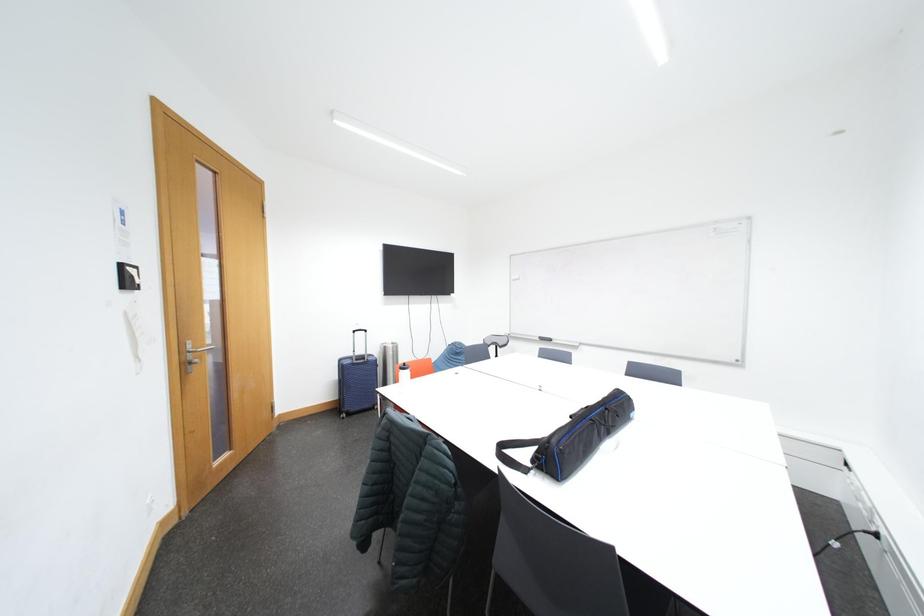
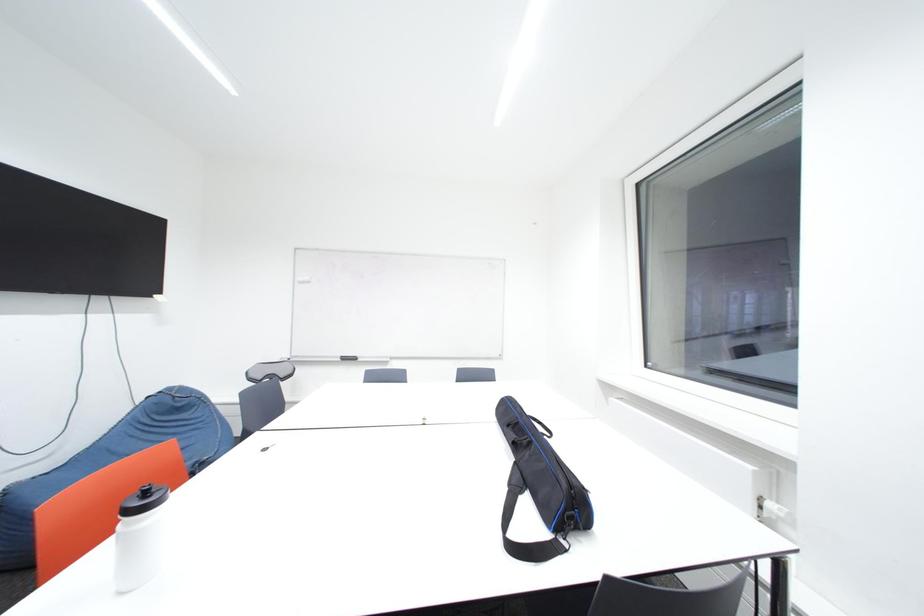
Question: How did the camera likely rotate?

Choices:
 (A) Left
 (B) Right
 (C) Up
 (D) Down

Answer: (B)